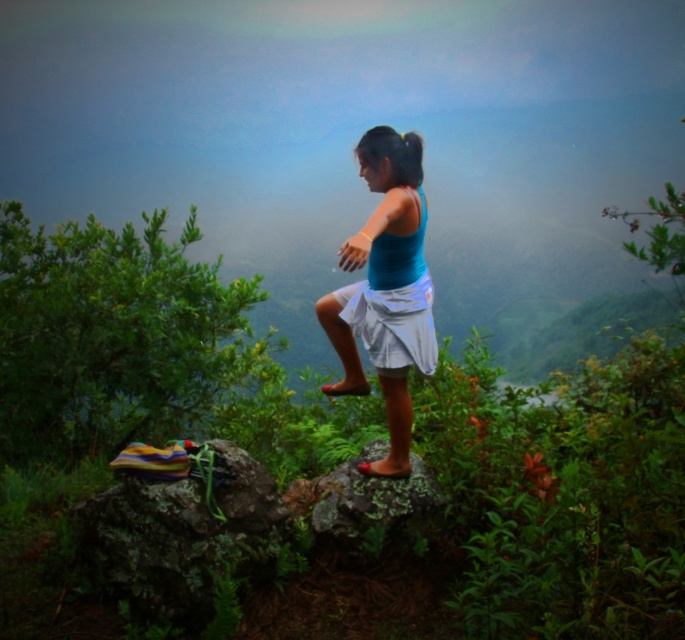
You are a photographer planning to take a picture of the green leafy bush at center and the multicolored fabric at center. Which object will appear taller in the photo?

The multicolored fabric at center appears taller than the green leafy bush at center in the photo.

From the picture: You are a photographer positioned at the scene. You want to capture a closeup shot of the multicolored fabric at center without including the girl in the frame. Given that your camera has a focal length of 50mm and you are currently 10 feet away from the fabric, can you adjust your position to achieve this composition?

The multicolored fabric at center is 10.50 feet away from the viewer. Since you are currently 10 feet away, you need to move back approximately 0.5 feet to ensure the girl is out of frame while keeping the fabric in focus.